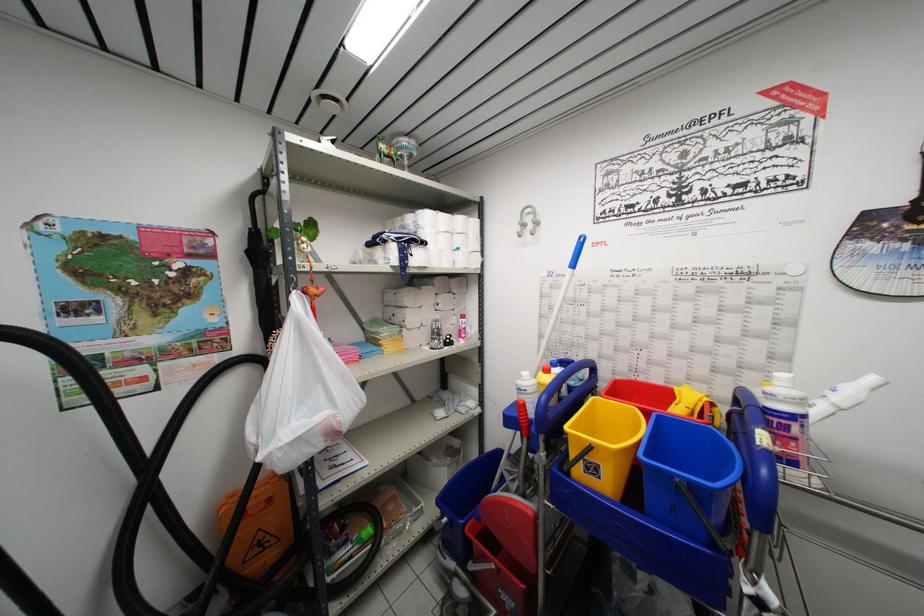
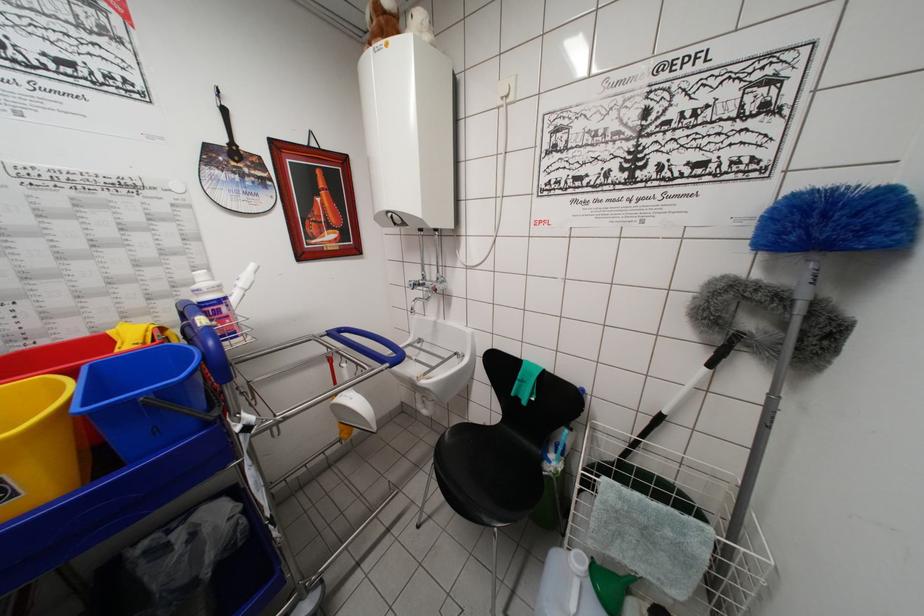
Locate, in the second image, the point that corresponds to (783,428) in the first image.

(215, 315)